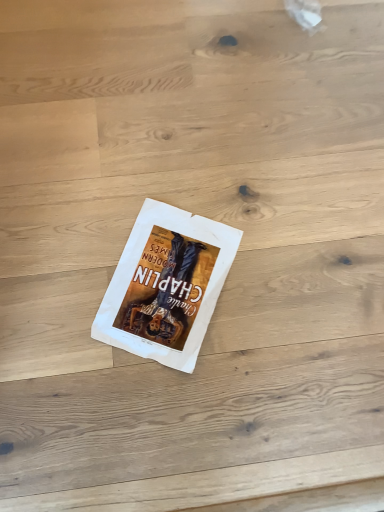
What do you see at coordinates (166, 285) in the screenshot?
I see `white paper book at center` at bounding box center [166, 285].

Find the location of a particular element. The height and width of the screenshot is (512, 384). white paper book at center is located at coordinates (166, 285).

At what (x,y) coordinates should I click in order to perform the action: click on white paper book at center. Please return your answer as a coordinate pair (x, y). This screenshot has height=512, width=384. Looking at the image, I should click on (166, 285).